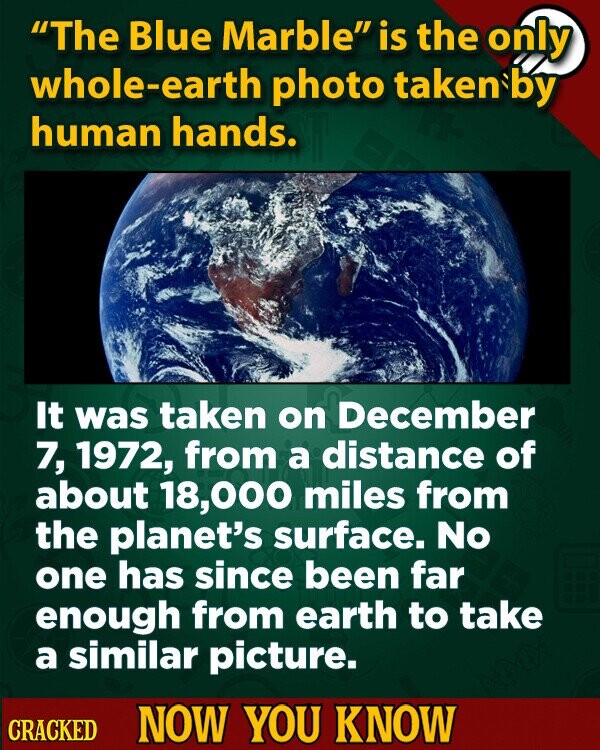
In order to click on calculator in this screenshot , I will do `click(573, 604)`.